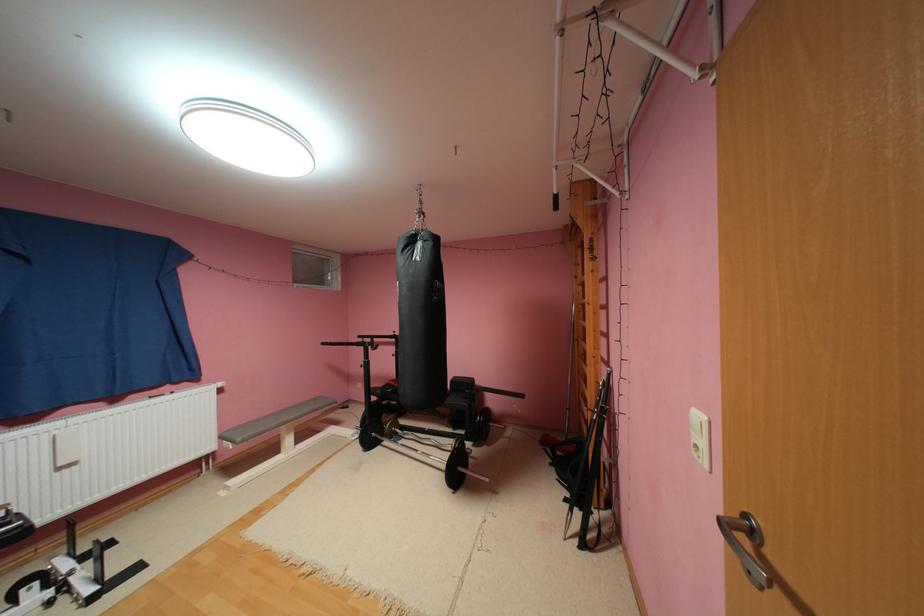
At what (x,y) coordinates should I click in order to perform the action: click on silver door handle. Please return your answer as a coordinate pair (x, y). Looking at the image, I should click on (745, 545).